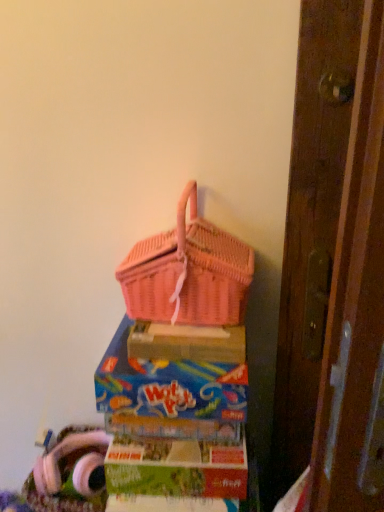
What do you see at coordinates (187, 343) in the screenshot?
I see `cardboard box at upper right` at bounding box center [187, 343].

The image size is (384, 512). What do you see at coordinates (176, 467) in the screenshot?
I see `matte cardboard box at lower center, which ranks as the 1th box in bottom-to-top order` at bounding box center [176, 467].

At what (x,y) coordinates should I click in order to perform the action: click on pink wicker basket at upper center, the second box from the bottom. Please return your answer as a coordinate pair (x, y). The image size is (384, 512). Looking at the image, I should click on (169, 395).

Locate an element on the screen. pink wicker picnic basket at upper center is located at coordinates (188, 273).

Considering the sizes of objects cardboard box at upper right and matte cardboard box at lower center, which ranks as the 2th box in top-to-bottom order, in the image provided, who is smaller, cardboard box at upper right or matte cardboard box at lower center, which ranks as the 2th box in top-to-bottom order,?

Smaller between the two is cardboard box at upper right.

Considering the sizes of cardboard box at upper right and matte cardboard box at lower center, which ranks as the 2th box in top-to-bottom order, in the image, is cardboard box at upper right taller or shorter than matte cardboard box at lower center, which ranks as the 2th box in top-to-bottom order,?

Considering their sizes, cardboard box at upper right has less height than matte cardboard box at lower center, which ranks as the 2th box in top-to-bottom order.

How different are the orientations of cardboard box at upper right and matte cardboard box at lower center, which ranks as the 1th box in bottom-to-top order, in degrees?

1.68 degrees separate the facing orientations of cardboard box at upper right and matte cardboard box at lower center, which ranks as the 1th box in bottom-to-top order.

In order to click on the 1st box to the left when counting from the cardboard box at upper right in this screenshot , I will do `click(176, 467)`.

Considering the sizes of cardboard box at upper right and pink wicker basket at upper center, the second box from the bottom, in the image, is cardboard box at upper right wider or thinner than pink wicker basket at upper center, the second box from the bottom,?

Clearly, cardboard box at upper right has less width compared to pink wicker basket at upper center, the second box from the bottom.

From the image's perspective, who appears lower, cardboard box at upper right or pink wicker basket at upper center, placed as the first box when sorted from top to bottom?

pink wicker basket at upper center, placed as the first box when sorted from top to bottom.

In terms of size, does cardboard box at upper right appear bigger or smaller than pink wicker basket at upper center, the second box from the bottom?

Considering their sizes, cardboard box at upper right takes up less space than pink wicker basket at upper center, the second box from the bottom.

Between cardboard box at upper right and pink wicker basket at upper center, placed as the first box when sorted from top to bottom, which one is positioned behind?

cardboard box at upper right is more distant.

From the image's perspective, does pink wicker picnic basket at upper center appear lower than cardboard box at upper right?

No, from the image's perspective, pink wicker picnic basket at upper center is not beneath cardboard box at upper right.

Is pink wicker picnic basket at upper center not inside cardboard box at upper right?

Yes, pink wicker picnic basket at upper center is not within cardboard box at upper right.

Is point (204, 307) closer or farther from the camera than point (190, 328)?

Clearly, point (204, 307) is closer to the camera than point (190, 328).

Is pink wicker picnic basket at upper center at the left side of cardboard box at upper right?

Correct, you'll find pink wicker picnic basket at upper center to the left of cardboard box at upper right.

Is pink wicker basket at upper center, placed as the first box when sorted from top to bottom, positioned with its back to matte cardboard box at lower center, which ranks as the 2th box in top-to-bottom order?

No, pink wicker basket at upper center, placed as the first box when sorted from top to bottom, is not facing the opposite direction of matte cardboard box at lower center, which ranks as the 2th box in top-to-bottom order.

This screenshot has width=384, height=512. In order to click on box that appears in front of the matte cardboard box at lower center, which ranks as the 1th box in bottom-to-top order in this screenshot , I will do `click(169, 395)`.

Who is smaller, pink wicker basket at upper center, the second box from the bottom, or matte cardboard box at lower center, which ranks as the 1th box in bottom-to-top order?

matte cardboard box at lower center, which ranks as the 1th box in bottom-to-top order.

Does pink wicker basket at upper center, the second box from the bottom, come in front of matte cardboard box at lower center, which ranks as the 2th box in top-to-bottom order?

Yes, pink wicker basket at upper center, the second box from the bottom, is closer to the viewer.

Does point (107, 360) appear closer or farther from the camera than point (178, 305)?

Point (107, 360).

Find the location of a particular element. The height and width of the screenshot is (512, 384). picnic basket above the pink wicker basket at upper center, placed as the first box when sorted from top to bottom (from a real-world perspective) is located at coordinates (188, 273).

Visually, is pink wicker basket at upper center, placed as the first box when sorted from top to bottom, positioned to the left or to the right of pink wicker picnic basket at upper center?

pink wicker basket at upper center, placed as the first box when sorted from top to bottom, is positioned on pink wicker picnic basket at upper center's left side.

Would you consider pink wicker picnic basket at upper center to be distant from pink wicker basket at upper center, placed as the first box when sorted from top to bottom?

They are positioned close to each other.

Is point (214, 249) farther from viewer compared to point (130, 422)?

No, (214, 249) is in front of (130, 422).

What's the angular difference between pink wicker picnic basket at upper center and pink wicker basket at upper center, the second box from the bottom,'s facing directions?

3.97 degrees.

From the image's perspective, which one is positioned higher, pink wicker picnic basket at upper center or pink wicker basket at upper center, placed as the first box when sorted from top to bottom?

From the image's view, pink wicker picnic basket at upper center is above.

Which is behind, point (236, 276) or point (166, 452)?

The point (166, 452) is farther.

Is pink wicker picnic basket at upper center at the right side of matte cardboard box at lower center, which ranks as the 2th box in top-to-bottom order?

No.

Is pink wicker picnic basket at upper center positioned in front of matte cardboard box at lower center, which ranks as the 2th box in top-to-bottom order?

Yes, pink wicker picnic basket at upper center is closer to the viewer.

This screenshot has height=512, width=384. I want to click on the 2nd box below when counting from the cardboard box at upper right (from the image's perspective), so click(176, 467).

I want to click on cardboard box behind the pink wicker basket at upper center, placed as the first box when sorted from top to bottom, so click(x=187, y=343).

Which object lies further to the anchor point cardboard box at upper right, pink wicker picnic basket at upper center or pink wicker basket at upper center, placed as the first box when sorted from top to bottom?

pink wicker picnic basket at upper center lies further to cardboard box at upper right than the other object.

Estimate the real-world distances between objects in this image. Which object is further from matte cardboard box at lower center, which ranks as the 2th box in top-to-bottom order, pink wicker picnic basket at upper center or cardboard box at upper right?

pink wicker picnic basket at upper center is positioned further to the anchor matte cardboard box at lower center, which ranks as the 2th box in top-to-bottom order.

Estimate the real-world distances between objects in this image. Which object is closer to pink wicker basket at upper center, placed as the first box when sorted from top to bottom, pink wicker picnic basket at upper center or cardboard box at upper right?

cardboard box at upper right is closer to pink wicker basket at upper center, placed as the first box when sorted from top to bottom.

Looking at the image, which one is located further to cardboard box at upper right, matte cardboard box at lower center, which ranks as the 2th box in top-to-bottom order, or pink wicker picnic basket at upper center?

matte cardboard box at lower center, which ranks as the 2th box in top-to-bottom order, is positioned further to the anchor cardboard box at upper right.

Looking at the image, which one is located further to pink wicker basket at upper center, placed as the first box when sorted from top to bottom, cardboard box at upper right or pink wicker picnic basket at upper center?

pink wicker picnic basket at upper center is further to pink wicker basket at upper center, placed as the first box when sorted from top to bottom.

When comparing their distances from pink wicker basket at upper center, the second box from the bottom, does pink wicker picnic basket at upper center or matte cardboard box at lower center, which ranks as the 1th box in bottom-to-top order, seem closer?

The object closer to pink wicker basket at upper center, the second box from the bottom, is matte cardboard box at lower center, which ranks as the 1th box in bottom-to-top order.

Which object lies nearer to the anchor point pink wicker picnic basket at upper center, pink wicker basket at upper center, placed as the first box when sorted from top to bottom, or cardboard box at upper right?

cardboard box at upper right is closer to pink wicker picnic basket at upper center.

Based on their spatial positions, is cardboard box at upper right or matte cardboard box at lower center, which ranks as the 1th box in bottom-to-top order, closer to pink wicker basket at upper center, placed as the first box when sorted from top to bottom?

The object closer to pink wicker basket at upper center, placed as the first box when sorted from top to bottom, is cardboard box at upper right.

You are a GUI agent. You are given a task and a screenshot of the screen. Output one action in this format:
    pyautogui.click(x=<x>, y=<y>)
    Task: Click on the cardboard box between pink wicker picnic basket at upper center and matte cardboard box at lower center, which ranks as the 2th box in top-to-bottom order, in the vertical direction
    This screenshot has width=384, height=512.
    Given the screenshot: What is the action you would take?
    pyautogui.click(x=187, y=343)

Find the location of a particular element. This screenshot has width=384, height=512. cardboard box between pink wicker picnic basket at upper center and pink wicker basket at upper center, placed as the first box when sorted from top to bottom, vertically is located at coordinates (187, 343).

I want to click on box between pink wicker picnic basket at upper center and matte cardboard box at lower center, which ranks as the 1th box in bottom-to-top order, in the vertical direction, so click(169, 395).

Where is `box that lies between cardboard box at upper right and matte cardboard box at lower center, which ranks as the 1th box in bottom-to-top order, from top to bottom`? box that lies between cardboard box at upper right and matte cardboard box at lower center, which ranks as the 1th box in bottom-to-top order, from top to bottom is located at coordinates (169, 395).